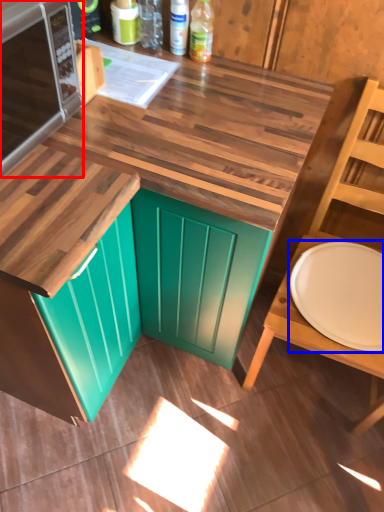
Question: Which point is closer to the camera, microwave oven (highlighted by a red box) or plate (highlighted by a blue box)?

Choices:
 (A) microwave oven
 (B) plate

Answer: (A)